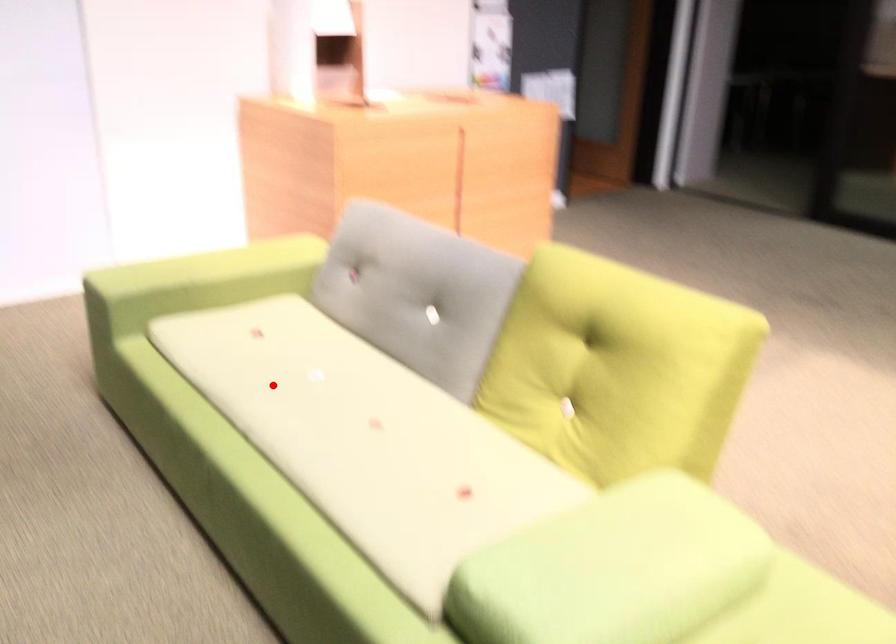
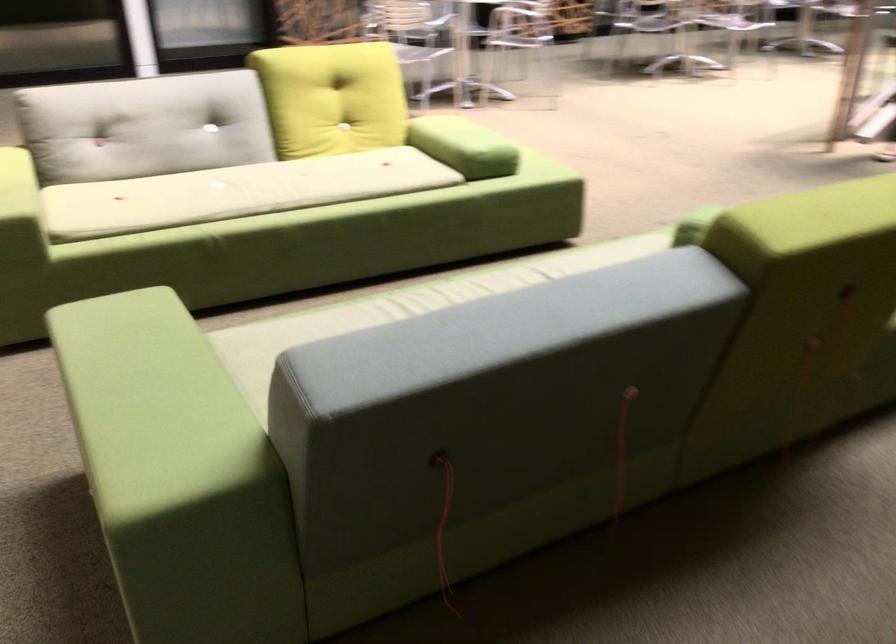
Question: I am providing you with two images of the same scene from different viewpoints. A red point is shown in image1. For the corresponding object point in image2, is it positioned nearer or farther from the camera?

Choices:
 (A) Nearer
 (B) Farther

Answer: (B)